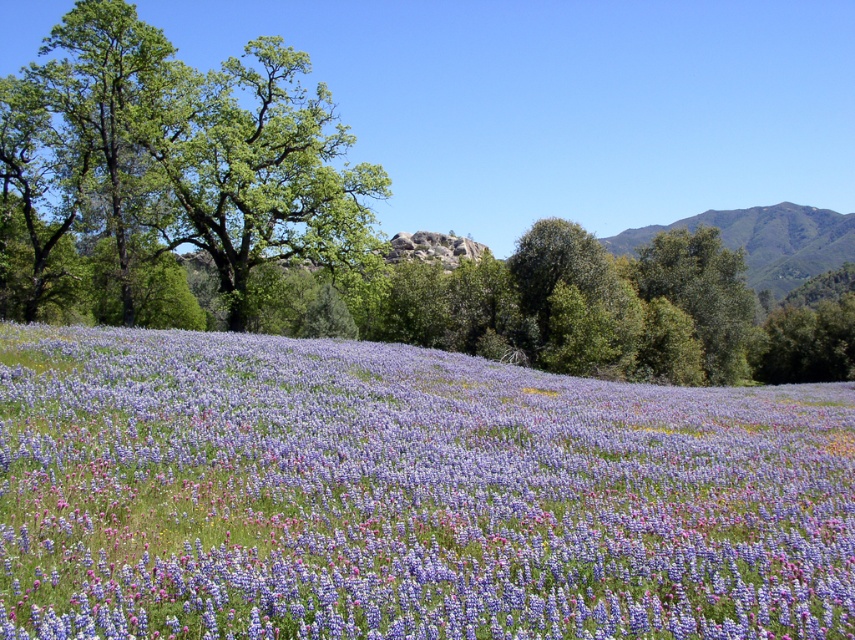
Question: Which point is closer to the camera?

Choices:
 (A) tap(16, 180)
 (B) tap(146, 593)

Answer: (B)

Question: Which of the following is the closest to the observer?

Choices:
 (A) (818, 413)
 (B) (325, 243)

Answer: (A)

Question: Where is purple matte flower at center located in relation to green leafy tree at upper left in the image?

Choices:
 (A) right
 (B) left

Answer: (A)

Question: Is purple matte flower at center positioned in front of green leafy tree at upper left?

Choices:
 (A) yes
 (B) no

Answer: (A)

Question: Does purple matte flower at center appear on the right side of green leafy tree at upper left?

Choices:
 (A) no
 (B) yes

Answer: (B)